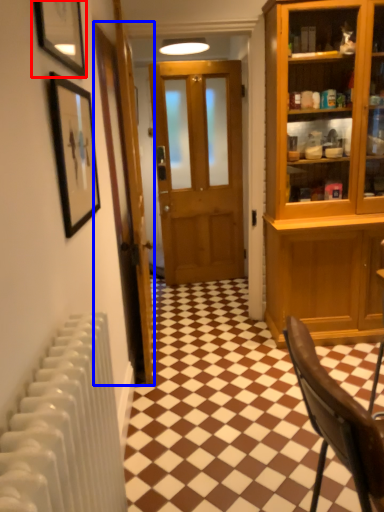
Question: Which point is further to the camera, picture frame (highlighted by a red box) or door (highlighted by a blue box)?

Choices:
 (A) picture frame
 (B) door

Answer: (B)